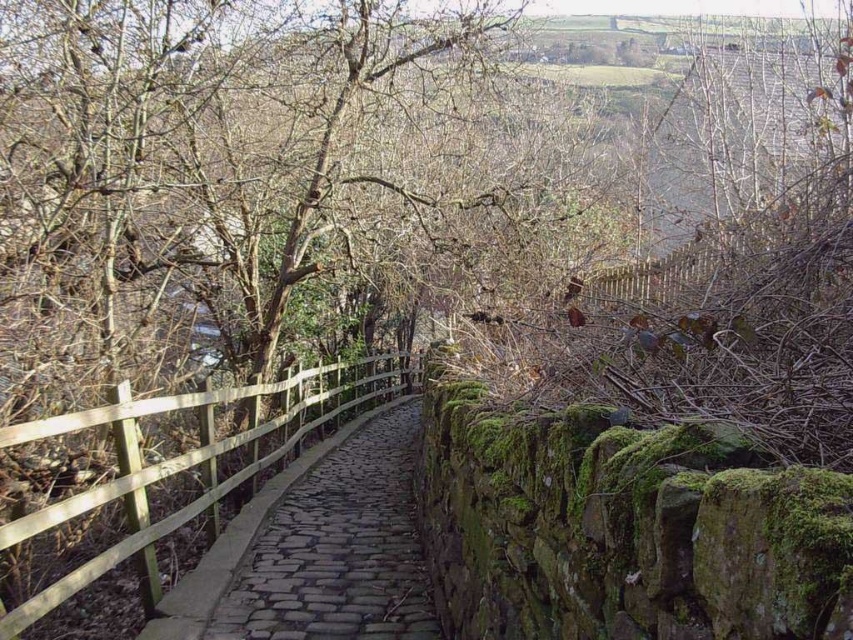
You are a hiker trying to navigate through the rural area shown in the image. You need to stay on the narrow cobblestone path at center while avoiding the wooden fence at center. Which one is narrower so you can plan your path?

The cobblestone path at center is thinner than the wooden fence at center, so you should follow the cobblestone path at center as it is narrower and safer for navigation.

You are standing at the start of the cobblestone path at center and want to walk towards the wooden fence at center. Which direction should you move to reach it?

The wooden fence at center is behind the cobblestone path at center, so you should move forward along the cobblestone path at center to reach it.